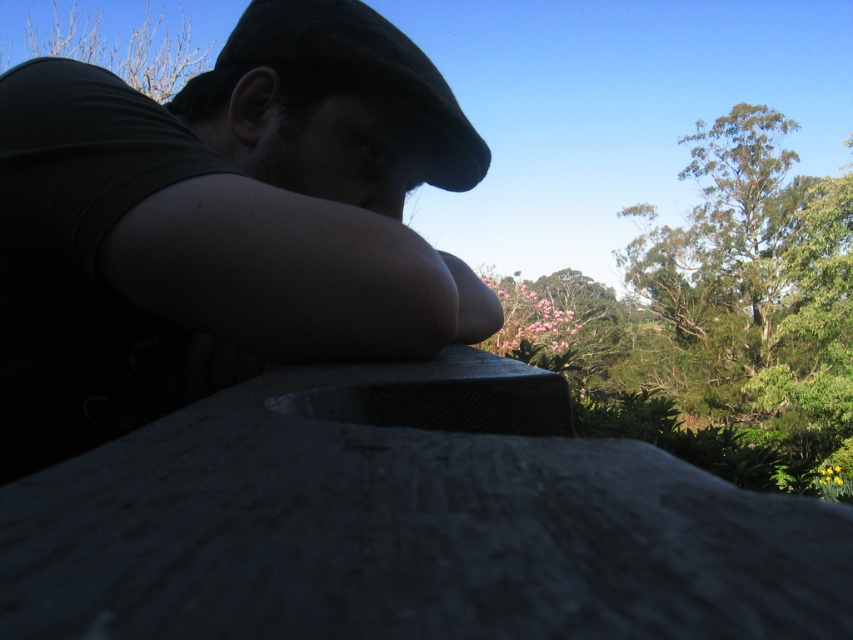
Question: Does matte black cap at upper center appear on the left side of black felt hat at upper center?

Choices:
 (A) yes
 (B) no

Answer: (A)

Question: Among these objects, which one is farthest from the camera?

Choices:
 (A) green leafy tree at upper right
 (B) matte black cap at upper center
 (C) bare branches at upper left

Answer: (C)

Question: Does green leafy tree at upper right appear on the left side of bare branches at upper left?

Choices:
 (A) yes
 (B) no

Answer: (B)

Question: Considering the relative positions of black felt hat at upper center and bare branches at upper left in the image provided, where is black felt hat at upper center located with respect to bare branches at upper left?

Choices:
 (A) right
 (B) left

Answer: (A)

Question: Among these points, which one is farthest from the camera?

Choices:
 (A) (181, 68)
 (B) (699, 289)

Answer: (B)

Question: Which point is farther to the camera?

Choices:
 (A) green leafy tree at upper right
 (B) black felt hat at upper center
 (C) bare branches at upper left

Answer: (C)